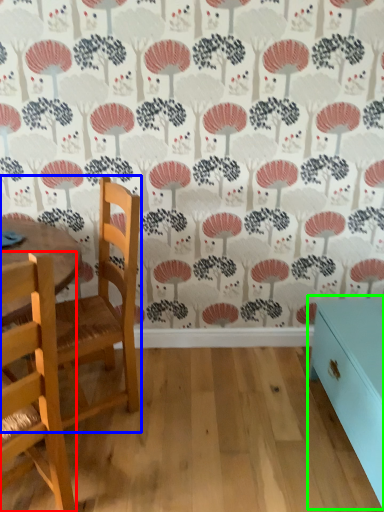
Question: Which is nearer to the chair (highlighted by a red box)? chair (highlighted by a blue box) or table (highlighted by a green box).

Choices:
 (A) chair
 (B) table

Answer: (A)